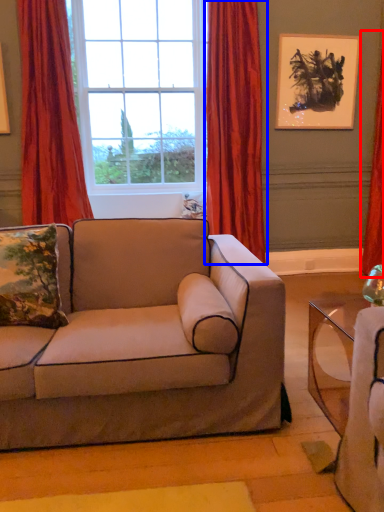
Question: Which point is further to the camera, curtain (highlighted by a red box) or curtain (highlighted by a blue box)?

Choices:
 (A) curtain
 (B) curtain

Answer: (A)